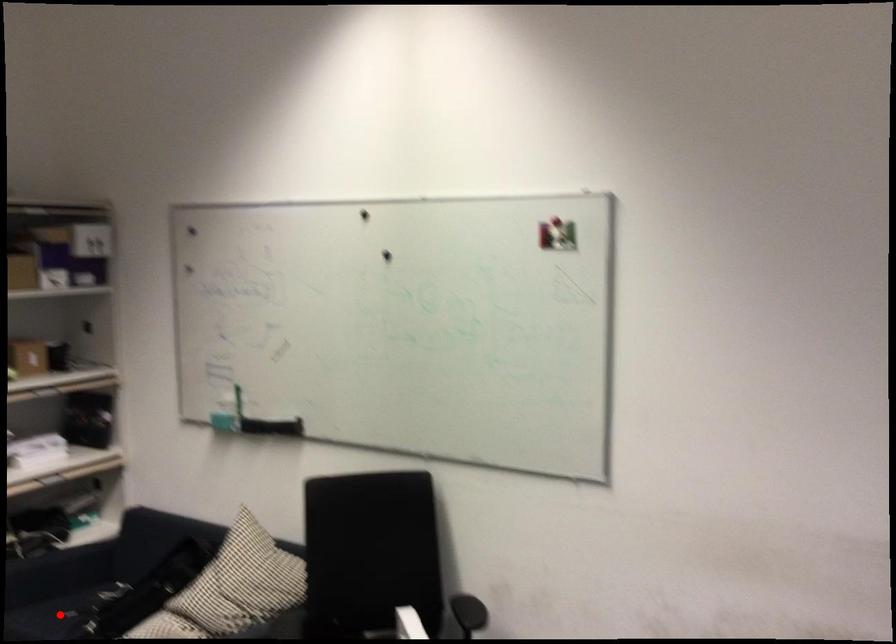
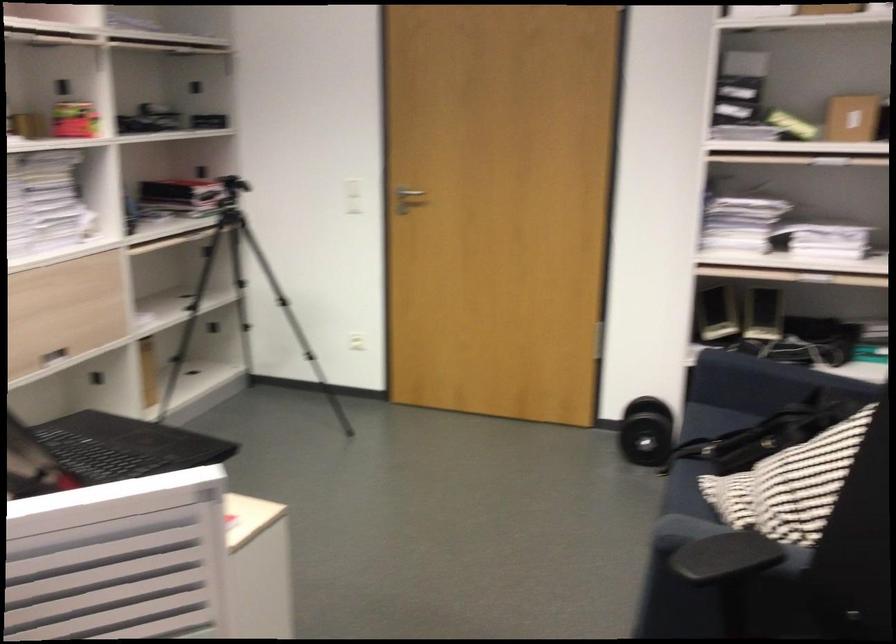
Question: I am providing you with two images of the same scene from different viewpoints. A red point is marked on the first image. Can you still see the location of the red point in image 2?

Choices:
 (A) Yes
 (B) No

Answer: (B)